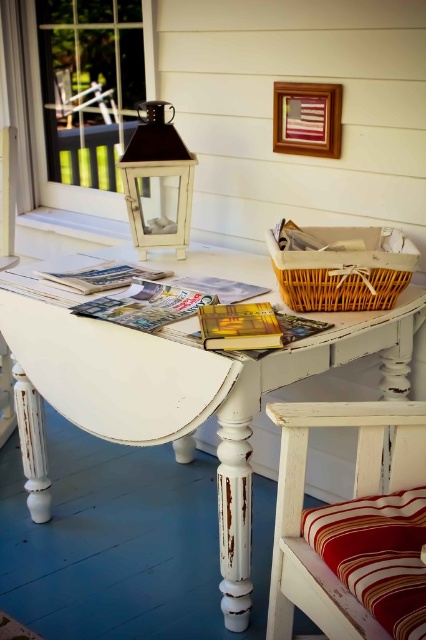
Between point (149, 336) and point (123, 156), which one is positioned in front?

Point (149, 336)

Between white distressed wood table at center and matte glass lantern at upper center, which one is positioned lower?

white distressed wood table at center

Which is in front, point (155, 387) or point (181, 259)?

Positioned in front is point (155, 387).

The image size is (426, 640). I want to click on white distressed wood table at center, so click(x=195, y=392).

Does printed paper magazine at center have a lesser height compared to matte paper magazine at center?

No.

Who is more forward, (112, 308) or (51, 275)?

Positioned in front is point (112, 308).

This screenshot has width=426, height=640. What are the coordinates of `printed paper magazine at center` in the screenshot? It's located at (146, 305).

Can you confirm if distressed white wooden chair with striped cushion at lower right is bigger than matte yellow magazine at center?

Yes.

What are the coordinates of `distressed white wooden chair with striped cushion at lower right` in the screenshot? It's located at (354, 486).

Is point (276, 508) less distant than point (235, 298)?

Yes, point (276, 508) is closer to viewer.

This screenshot has height=640, width=426. I want to click on distressed white wooden chair with striped cushion at lower right, so tap(354, 486).